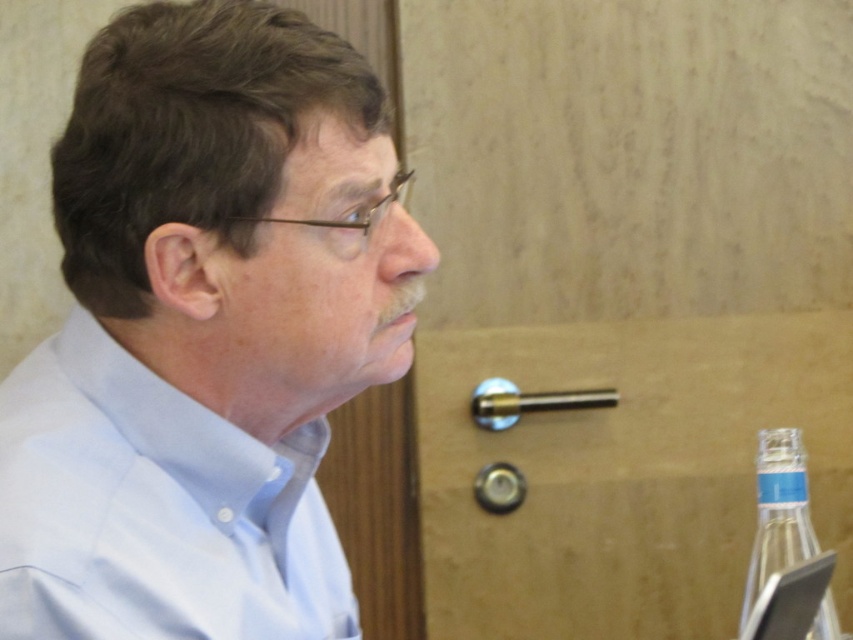
Question: Does light blue shirt at center come behind light blue cotton shirt at left?

Choices:
 (A) yes
 (B) no

Answer: (A)

Question: Does light blue shirt at center come behind light blue cotton shirt at left?

Choices:
 (A) yes
 (B) no

Answer: (A)

Question: Considering the relative positions of light blue shirt at center and light blue cotton shirt at left in the image provided, where is light blue shirt at center located with respect to light blue cotton shirt at left?

Choices:
 (A) right
 (B) left

Answer: (A)

Question: Which is nearer to the light blue cotton shirt at left?

Choices:
 (A) clear glass bottle at lower right
 (B) light blue shirt at center

Answer: (B)

Question: Which of the following is the farthest from the observer?

Choices:
 (A) (51, 490)
 (B) (820, 618)
 (C) (210, 314)

Answer: (B)

Question: Which of the following is the farthest from the observer?

Choices:
 (A) (158, 406)
 (B) (779, 552)

Answer: (B)